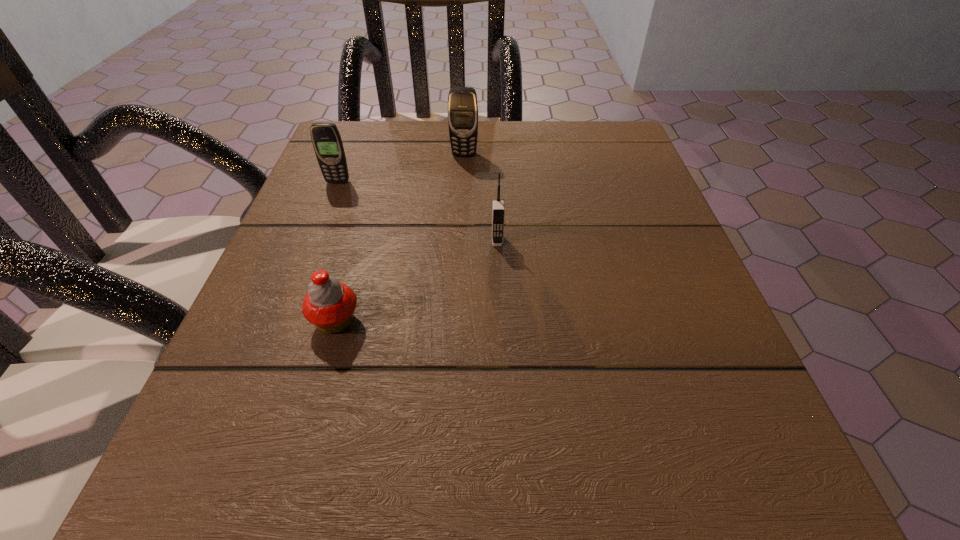
Where is `free spot between the rightmost object and the farthest object`? Image resolution: width=960 pixels, height=540 pixels. free spot between the rightmost object and the farthest object is located at coordinates (481, 198).

You are a GUI agent. You are given a task and a screenshot of the screen. Output one action in this format:
    pyautogui.click(x=<x>, y=<y>)
    Task: Click on the free point between the cupcake and the third farthest object
    The height and width of the screenshot is (540, 960).
    Given the screenshot: What is the action you would take?
    pyautogui.click(x=417, y=281)

This screenshot has width=960, height=540. What are the coordinates of `blank region between the farthest cellular telephone and the leftmost cellular telephone` in the screenshot? It's located at (401, 168).

Identify the location of vacant space that's between the farthest cellular telephone and the nearest object. The image size is (960, 540). (400, 238).

In order to click on vacant space that is in between the second nearest cellular telephone and the third object from right to left in this screenshot , I will do `click(337, 252)`.

Locate an element on the screen. This screenshot has width=960, height=540. vacant point located between the leftmost object and the nearest cellular telephone is located at coordinates pos(418,211).

At what (x,y) coordinates should I click in order to perform the action: click on free spot between the third object from left to right and the second nearest cellular telephone. Please return your answer as a coordinate pair (x, y). The height and width of the screenshot is (540, 960). Looking at the image, I should click on (401, 168).

Find the location of a particular element. Image resolution: width=960 pixels, height=540 pixels. free area in between the third nearest object and the second object from left to right is located at coordinates (337, 252).

At what (x,y) coordinates should I click in order to perform the action: click on free space between the farthest cellular telephone and the cupcake. Please return your answer as a coordinate pair (x, y). The width and height of the screenshot is (960, 540). Looking at the image, I should click on (400, 238).

I want to click on vacant area between the rightmost cellular telephone and the leftmost object, so click(x=418, y=211).